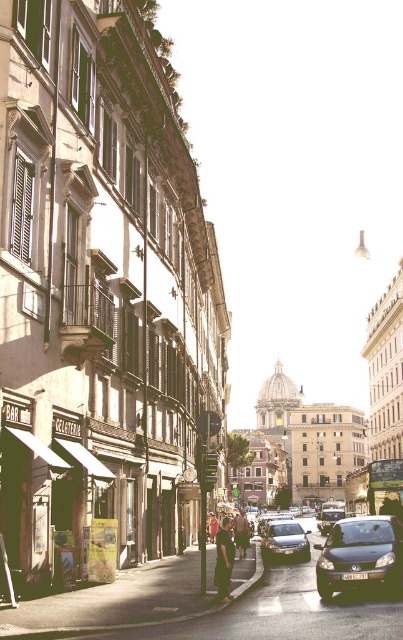
You are standing on the sidewalk in the historic city street scene. You see a shiny silver car at center. Where exactly is the shiny silver car located in relation to the point marked at coordinates point (328,518)?

The shiny silver car at center is located exactly at the point marked at coordinates point (328,518).

You are a delivery person needing to cross the street to deliver a package to the Gelateria. The shiny silver car at center is blocking the path. Can you safely walk around it to reach the sidewalk where the light brown leather jacket at center is located?

The shiny silver car at center is 103.88 feet away from the light brown leather jacket at center. Since the car is blocking the path, you can safely walk around it to reach the sidewalk where the light brown leather jacket at center is located as the distance between them allows enough space for movement.

You are standing at the point marked as point (361, 554) in the image, which is located at the lower right corner. You want to walk to the nearest building entrance. Which direction should you head towards?

The point (361, 554) corresponds to the matte black car at lower right, so you should head towards the building entrance nearest to the matte black car at lower right.